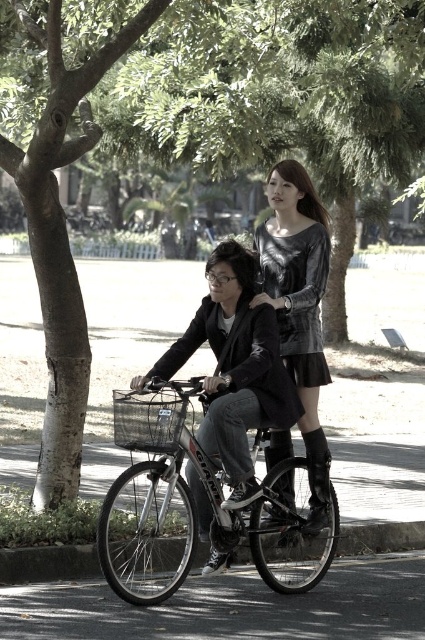
Question: Considering the real-world distances, which object is farthest from the silver metallic bicycle at center?

Choices:
 (A) velvet-like dress at center
 (B) black wire basket at center

Answer: (A)

Question: Is shiny black dress at center below black wire basket at center?

Choices:
 (A) yes
 (B) no

Answer: (B)

Question: Which object is positioned farthest from the shiny black dress at center?

Choices:
 (A) velvet-like dress at center
 (B) black wire basket at center

Answer: (A)

Question: Does shiny black dress at center have a lesser width compared to velvet-like dress at center?

Choices:
 (A) no
 (B) yes

Answer: (A)

Question: Where is silver metallic bicycle at center located in relation to velvet-like dress at center in the image?

Choices:
 (A) left
 (B) right

Answer: (A)

Question: Which point is farther to the camera?

Choices:
 (A) (246, 497)
 (B) (138, 404)
 (C) (184, 436)

Answer: (A)